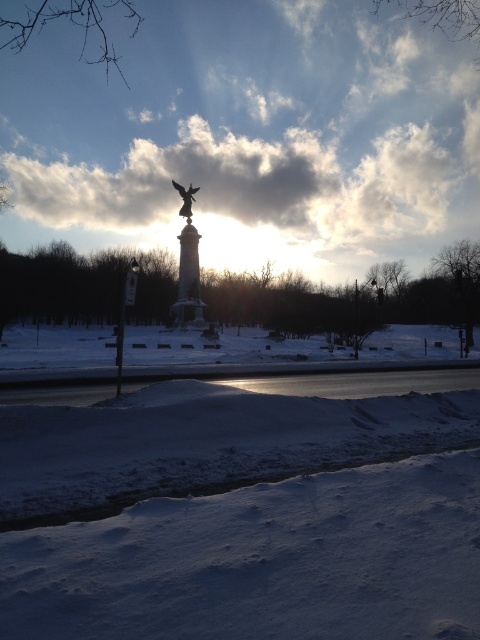
You are a photographer positioned at the edge of the road in the winter scene. You want to capture a photo that includes both the white powdery snow at center and the metallic pole at right. Which object should you focus on first to ensure both are in sharp focus?

You should focus on the white powdery snow at center first because it is closer to the viewer than the metallic pole at right, so focusing on the closer object will ensure the pole in the background is also in focus.

You are a snowplow driver needing to clear the road. The white powdery snow at center and the metallic pole at right are in your path. Which object has a narrower width that you need to maneuver around?

The white powdery snow at center has a lesser width compared to the metallic pole at right, so you need to maneuver around the narrower white powdery snow at center.

You are standing at the monument in the background and want to walk towards the road in the middle. Which point, point (54, 218) or point (76, 170), is closer to your current position?

Point (76, 170) is closer to your current position at the monument because it is behind point (54, 218), which is in front of it.